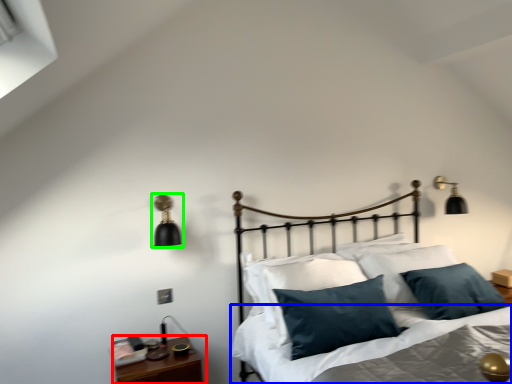
Question: Considering the real-world distances, which object is closest to nightstand (highlighted by a red box)? sheet (highlighted by a blue box) or lamp (highlighted by a green box).

Choices:
 (A) sheet
 (B) lamp

Answer: (A)